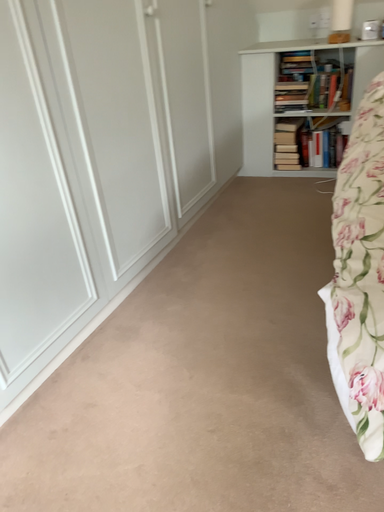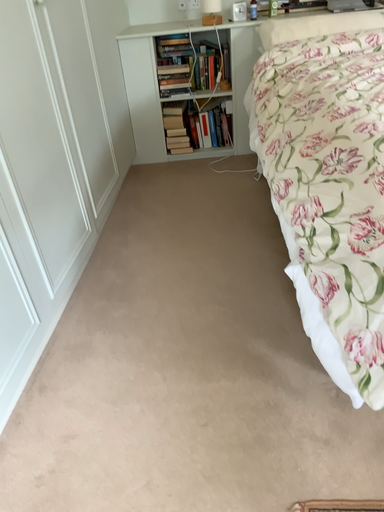
Question: Which way did the camera rotate in the video?

Choices:
 (A) rotated left
 (B) rotated right

Answer: (B)